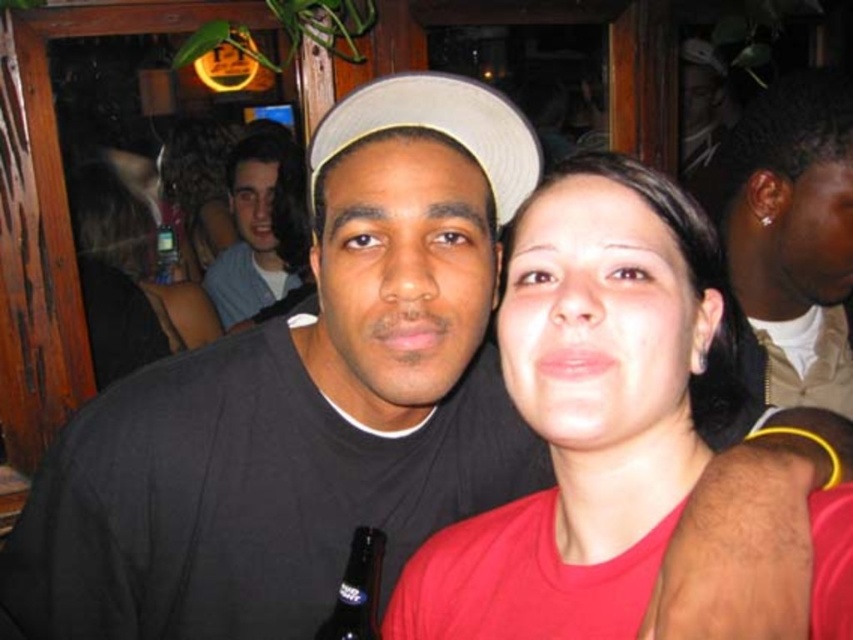
Question: Does matte red shirt at center have a greater width compared to transparent plastic bottle at upper left?

Choices:
 (A) no
 (B) yes

Answer: (B)

Question: Among these points, which one is farthest from the camera?

Choices:
 (A) (402, 113)
 (B) (85, 262)

Answer: (B)

Question: Can you confirm if matte red shirt at center is positioned to the right of light blue denim shirt at upper left?

Choices:
 (A) no
 (B) yes

Answer: (B)

Question: Which of the following is the closest to the observer?

Choices:
 (A) satin gold earring at upper right
 (B) matte red shirt at center

Answer: (B)

Question: Is matte red shirt at center thinner than smooth skin at center?

Choices:
 (A) yes
 (B) no

Answer: (A)

Question: Which point appears closest to the camera in this image?

Choices:
 (A) (252, 189)
 (B) (166, 240)
 (C) (616, 620)
 (D) (828, 257)

Answer: (C)